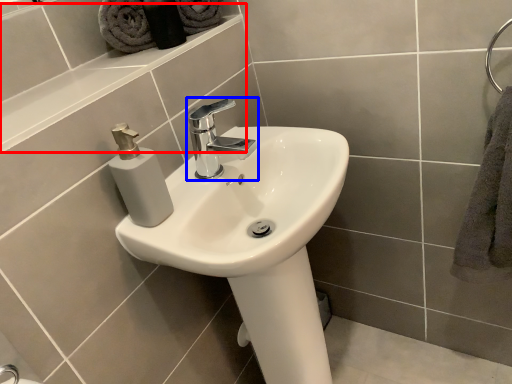
Question: Among these objects, which one is nearest to the camera, ledge (highlighted by a red box) or tap (highlighted by a blue box)?

Choices:
 (A) ledge
 (B) tap

Answer: (A)